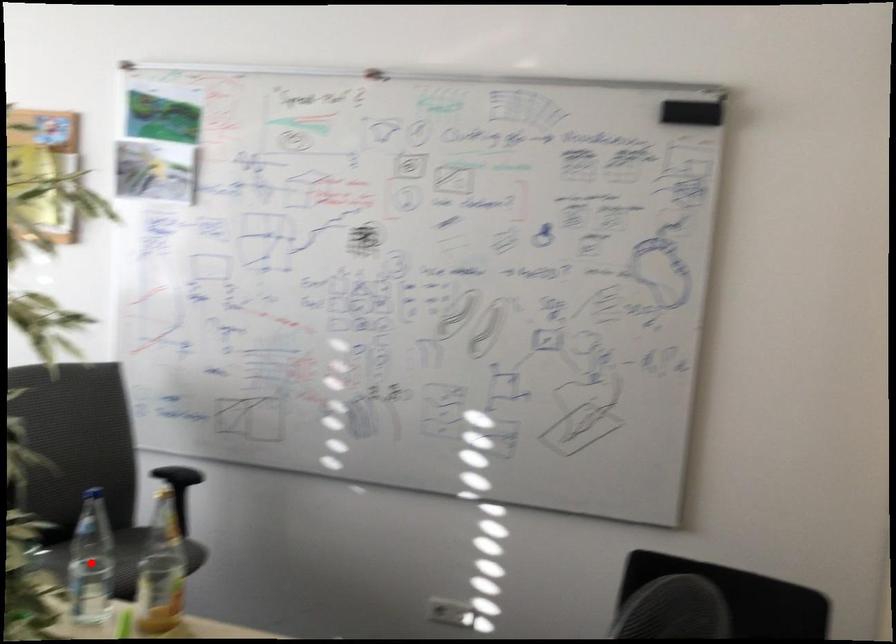
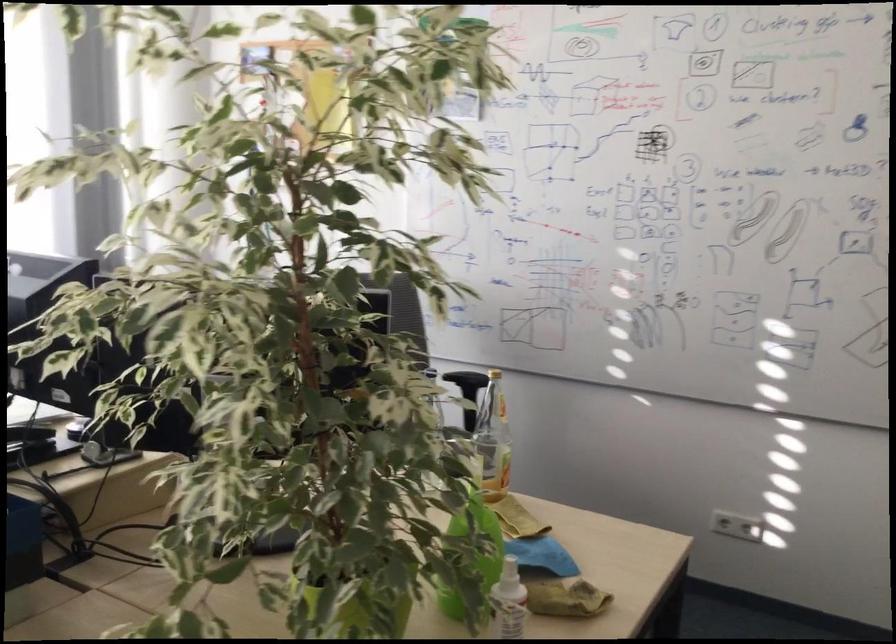
Question: I am providing you with two images of the same scene from different viewpoints. A red point is marked on the first image. Is the red point's position out of view in image 2?

Choices:
 (A) Yes
 (B) No

Answer: (A)